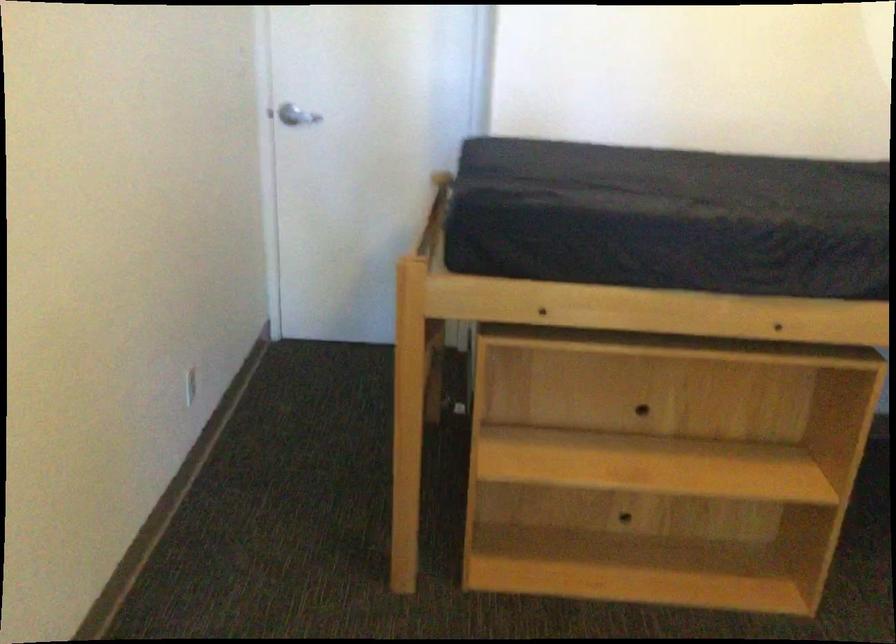
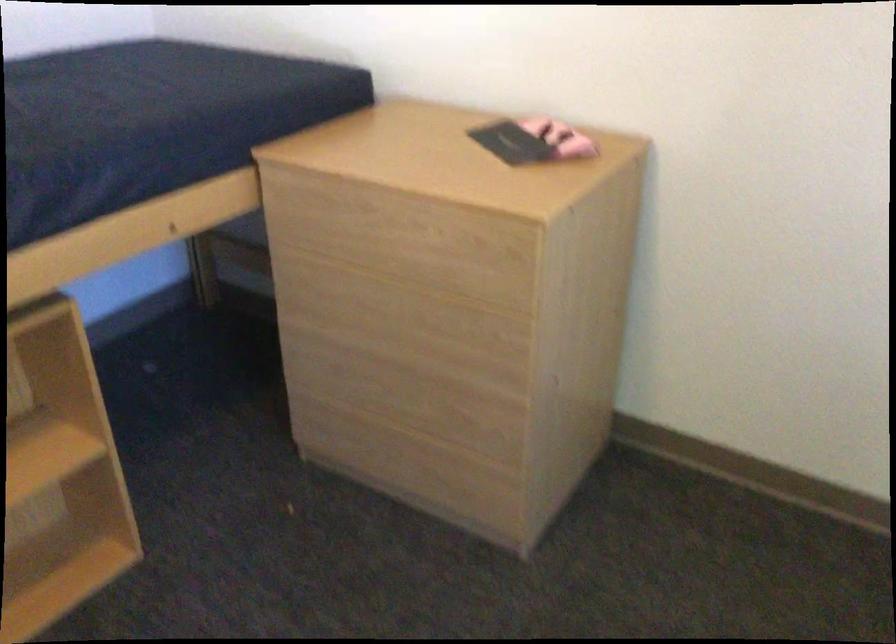
How did the camera likely rotate?

The camera rotated toward right-down.